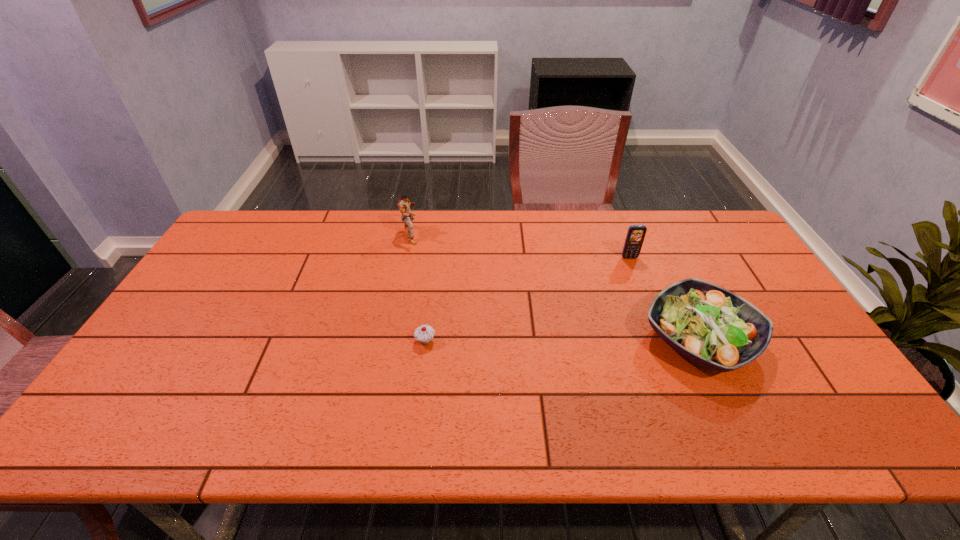
Identify the location of free location located 0.060m on the front of the shortest object. This screenshot has width=960, height=540. (422, 368).

At what (x,y) coordinates should I click in order to perform the action: click on object located in the far edge section of the desktop. Please return your answer as a coordinate pair (x, y). The image size is (960, 540). Looking at the image, I should click on (404, 204).

Where is `object that is positioned at the right edge`? object that is positioned at the right edge is located at coordinates (708, 324).

Where is `vacant space at the far edge`? Image resolution: width=960 pixels, height=540 pixels. vacant space at the far edge is located at coordinates (532, 235).

The image size is (960, 540). Find the location of `vacant area at the near edge`. vacant area at the near edge is located at coordinates (594, 424).

Locate an element on the screen. Image resolution: width=960 pixels, height=540 pixels. vacant region at the left edge of the desktop is located at coordinates (122, 392).

You are a GUI agent. You are given a task and a screenshot of the screen. Output one action in this format:
    pyautogui.click(x=<x>, y=<y>)
    Task: Click on the blank area at the far left corner
    This screenshot has height=540, width=960.
    Given the screenshot: What is the action you would take?
    pyautogui.click(x=259, y=219)

This screenshot has height=540, width=960. Find the location of `free space at the near right corner of the desktop`. free space at the near right corner of the desktop is located at coordinates (849, 438).

Find the location of a particular element. vacant area that lies between the third tallest object and the third object from right to left is located at coordinates (563, 341).

Find the location of a particular element. The height and width of the screenshot is (540, 960). vacant space that's between the cupcake and the third tallest object is located at coordinates (563, 341).